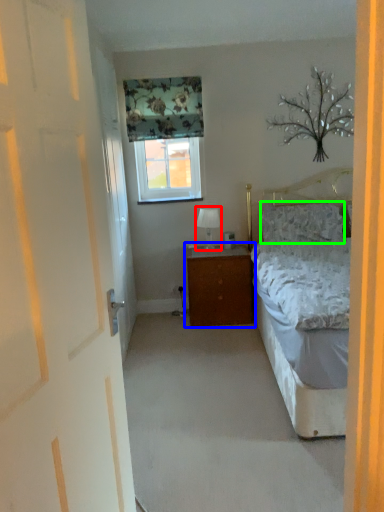
Question: Which object is the closest to the table lamp (highlighted by a red box)? Choose among these: nightstand (highlighted by a blue box) or pillow (highlighted by a green box).

Choices:
 (A) nightstand
 (B) pillow

Answer: (A)